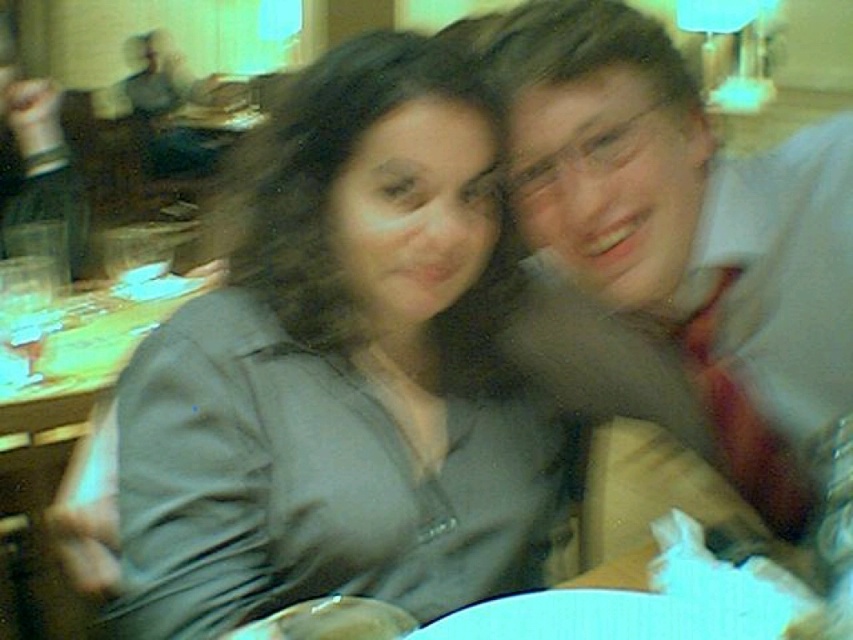
Question: Estimate the real-world distances between objects in this image. Which object is farther from the wooden table at lower left?

Choices:
 (A) matte white shirt at upper right
 (B) matte gray shirt at center

Answer: (A)

Question: Among these points, which one is farthest from the camera?

Choices:
 (A) (642, 230)
 (B) (3, 420)
 (C) (281, 134)

Answer: (B)

Question: From the image, what is the correct spatial relationship of matte gray shirt at center in relation to matte white shirt at upper right?

Choices:
 (A) above
 (B) below

Answer: (B)

Question: Does matte gray shirt at center have a larger size compared to matte white shirt at upper right?

Choices:
 (A) yes
 (B) no

Answer: (A)

Question: In this image, where is matte gray shirt at center located relative to wooden table at lower left?

Choices:
 (A) above
 (B) below

Answer: (B)

Question: Which of the following is the farthest from the observer?

Choices:
 (A) (445, 227)
 (B) (651, 177)
 (C) (148, 316)

Answer: (C)